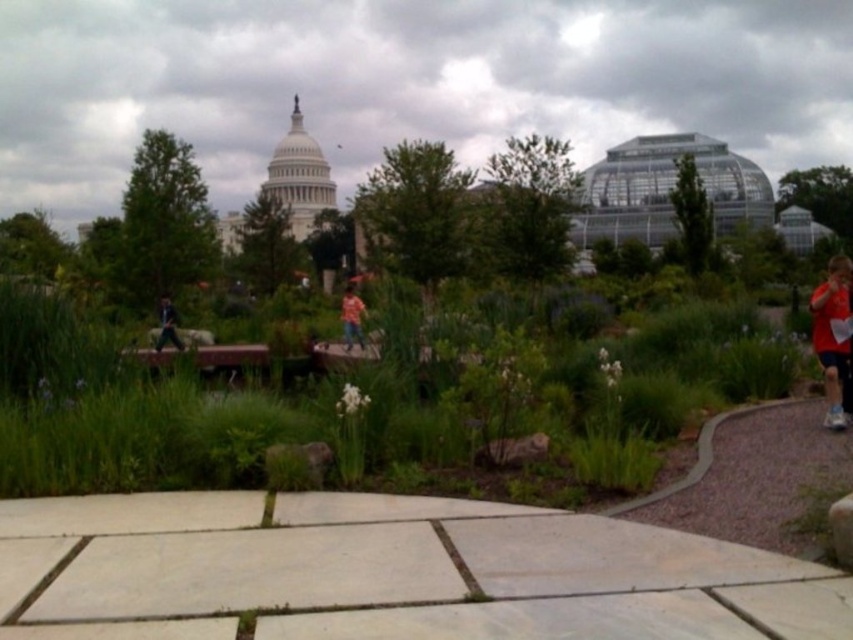
Which is below, red fabric shirt at right or orange shirt at center?

red fabric shirt at right is lower down.

Can you confirm if red fabric shirt at right is shorter than orange shirt at center?

Incorrect, red fabric shirt at right's height does not fall short of orange shirt at center's.

Which is in front, point (846, 289) or point (350, 346)?

Point (846, 289) is in front.

Locate an element on the screen. red fabric shirt at right is located at coordinates (833, 337).

Does orange shirt at center appear under black fabric jacket at lower left?

Actually, orange shirt at center is above black fabric jacket at lower left.

Locate an element on the screen. orange shirt at center is located at coordinates [351, 316].

This screenshot has height=640, width=853. In order to click on orange shirt at center in this screenshot , I will do `click(351, 316)`.

Can you confirm if smooth concrete path at center is positioned to the left of orange shirt at center?

No, smooth concrete path at center is not to the left of orange shirt at center.

Is smooth concrete path at center below orange shirt at center?

Yes, smooth concrete path at center is below orange shirt at center.

Is point (566, 520) positioned before point (349, 291)?

Yes, point (566, 520) is in front of point (349, 291).

At what (x,y) coordinates should I click in order to perform the action: click on smooth concrete path at center. Please return your answer as a coordinate pair (x, y). Looking at the image, I should click on (389, 572).